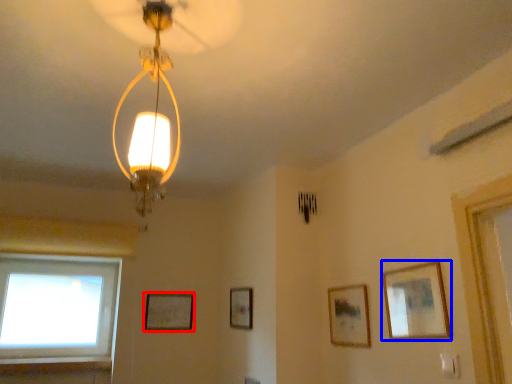
Question: Which object appears closest to the camera in this image, picture frame (highlighted by a red box) or picture frame (highlighted by a blue box)?

Choices:
 (A) picture frame
 (B) picture frame

Answer: (B)